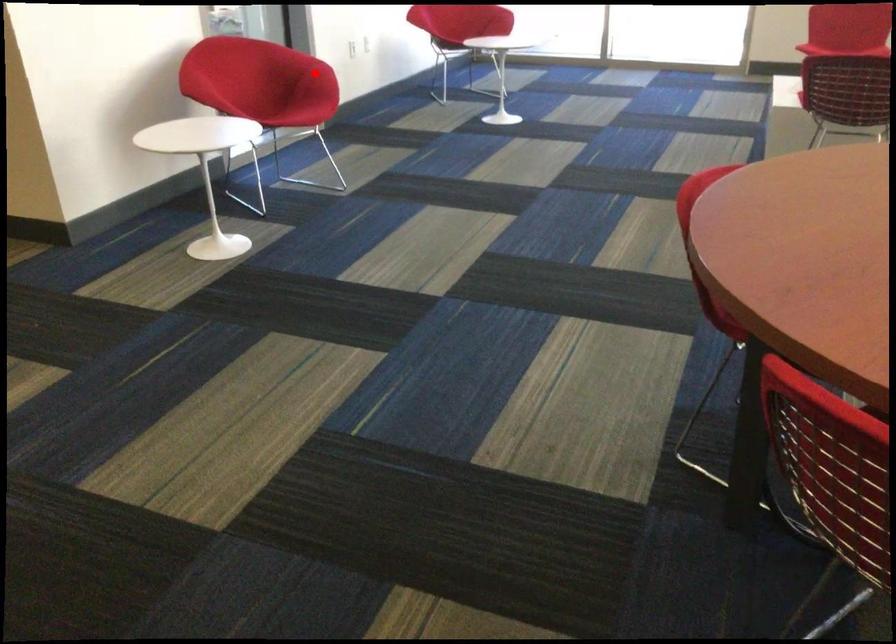
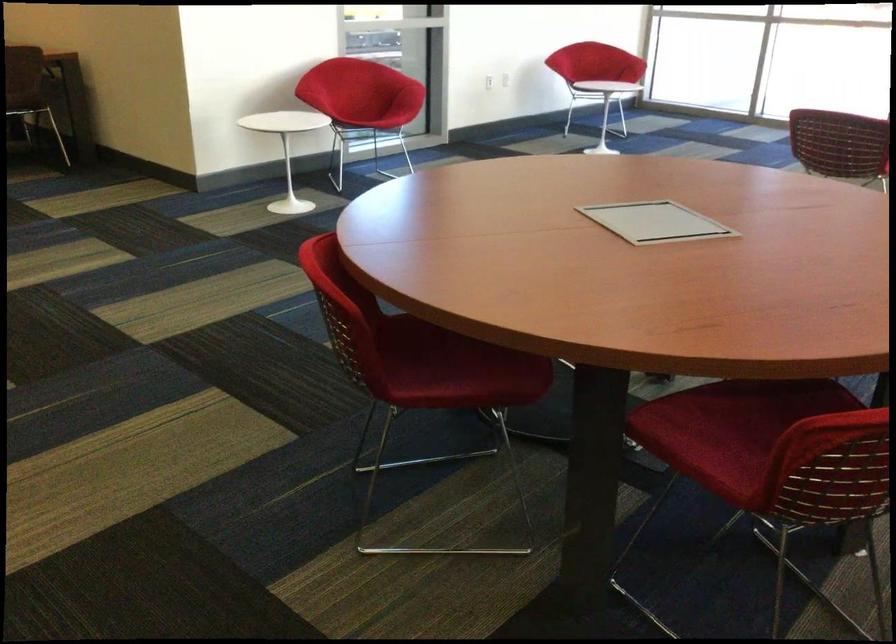
Find the pixel in the second image that matches the highlighted location in the first image.

(406, 87)